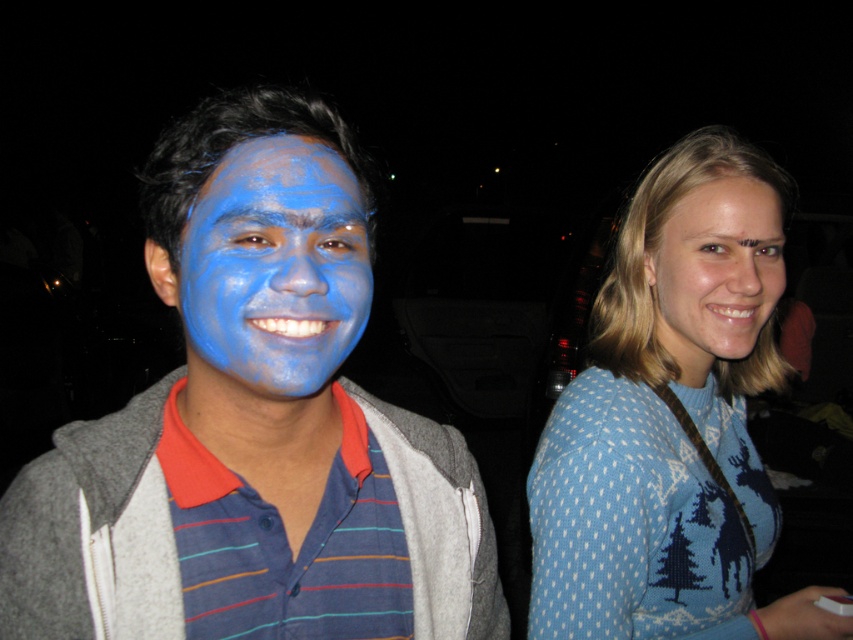
Please describe the position of the matte blue face paint at center in terms of coordinates. The answer should be in the format of coordinates in parentheses.

The matte blue face paint at center is located at coordinates point (252, 410).

You are a photographer trying to capture a clear shot of both the blue knitted sweater at upper right and the blue matte face at right. Based on their sizes, which object should you focus on first to ensure it fits in the frame?

The blue knitted sweater at upper right might be wider than the blue matte face at right, so you should focus on capturing the blue knitted sweater at upper right first to ensure it fits in the frame.

You are a photographer trying to capture a photo of both the point at position (151, 515) and the point at position (212, 266) in the scene. Based on their positions, which point is closer to your camera lens?

Point (212, 266) is closer to the camera lens than point (151, 515) because the description states that point (151, 515) is further away from the camera.